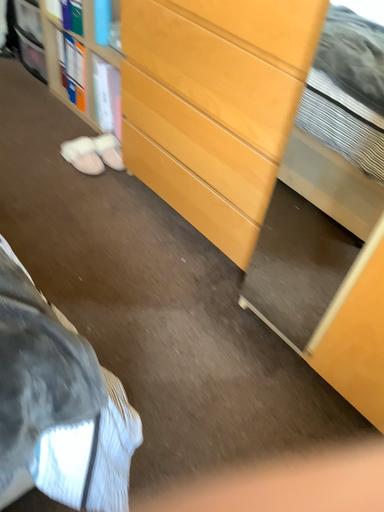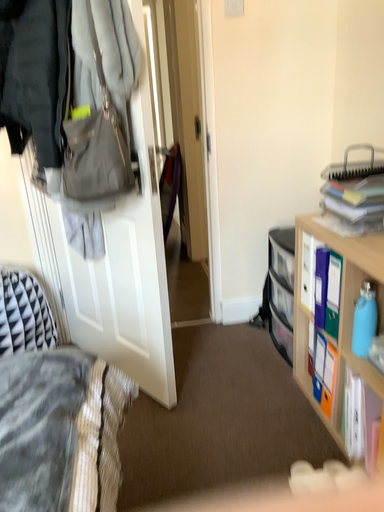
Question: Which way did the camera rotate in the video?

Choices:
 (A) rotated left
 (B) rotated right

Answer: (A)